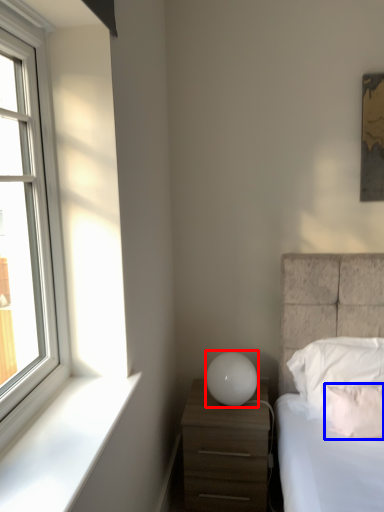
Question: Which point is closer to the camera, table lamp (highlighted by a red box) or pillow (highlighted by a blue box)?

Choices:
 (A) table lamp
 (B) pillow

Answer: (B)